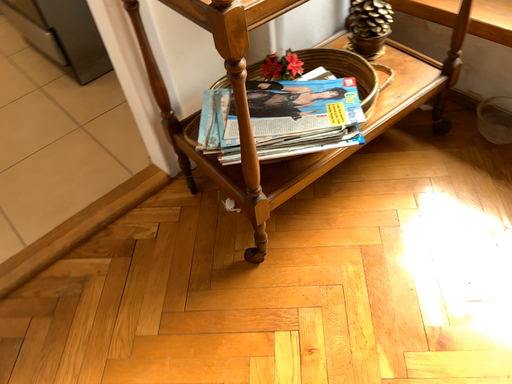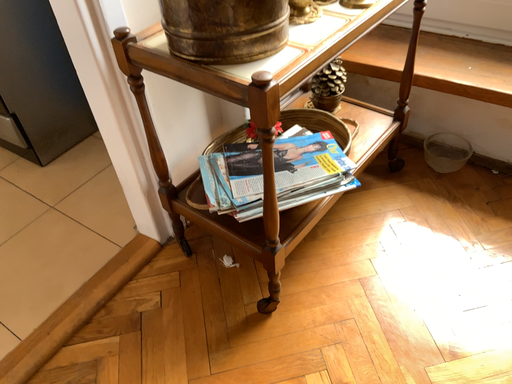
Question: How did the camera likely rotate when shooting the video?

Choices:
 (A) rotated right
 (B) rotated left

Answer: (A)